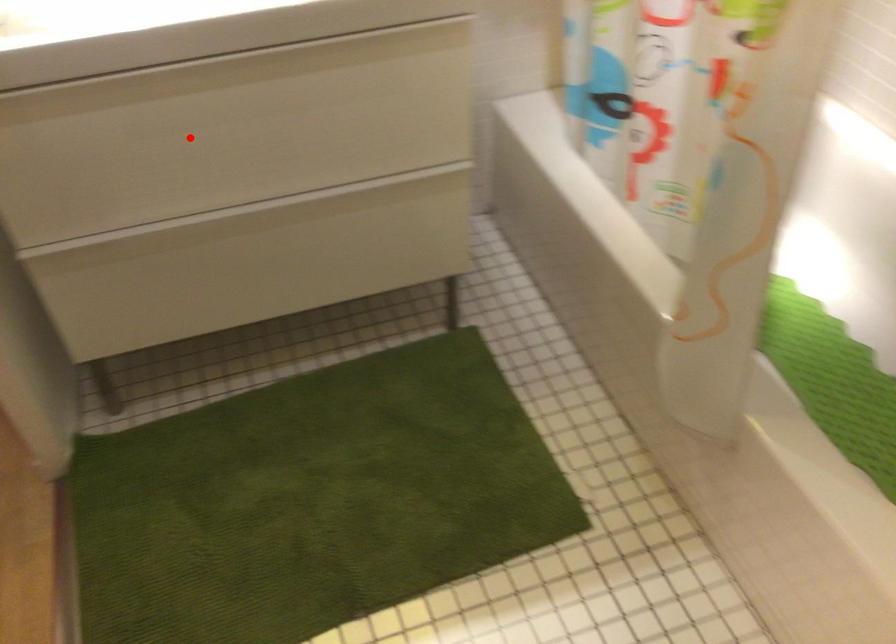
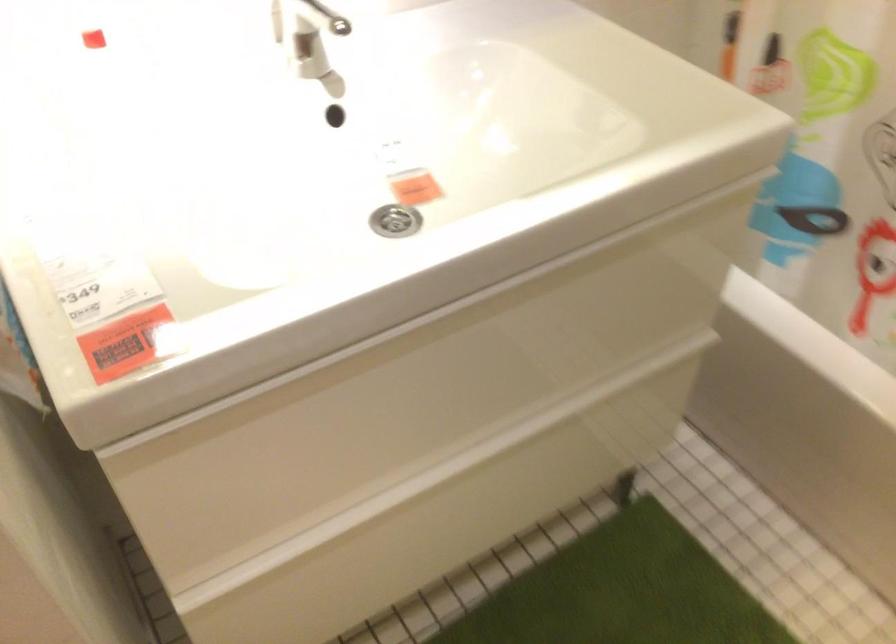
Question: I am providing you with two images of the same scene from different viewpoints. A red point is shown in image1. For the corresponding object point in image2, is it positioned nearer or farther from the camera?

Choices:
 (A) Nearer
 (B) Farther

Answer: (A)